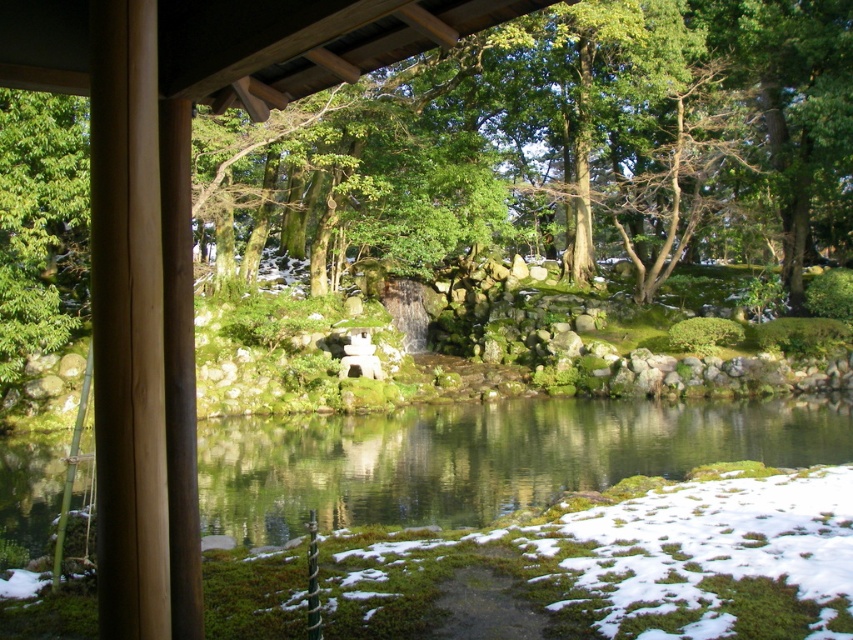
You are standing at the wooden structure in the scene. There is a point marked at coordinates (485, 458) which corresponds to a location in the image. What is the color and type of the feature at this point?

The point at coordinates (485, 458) marks green mossy water at center.